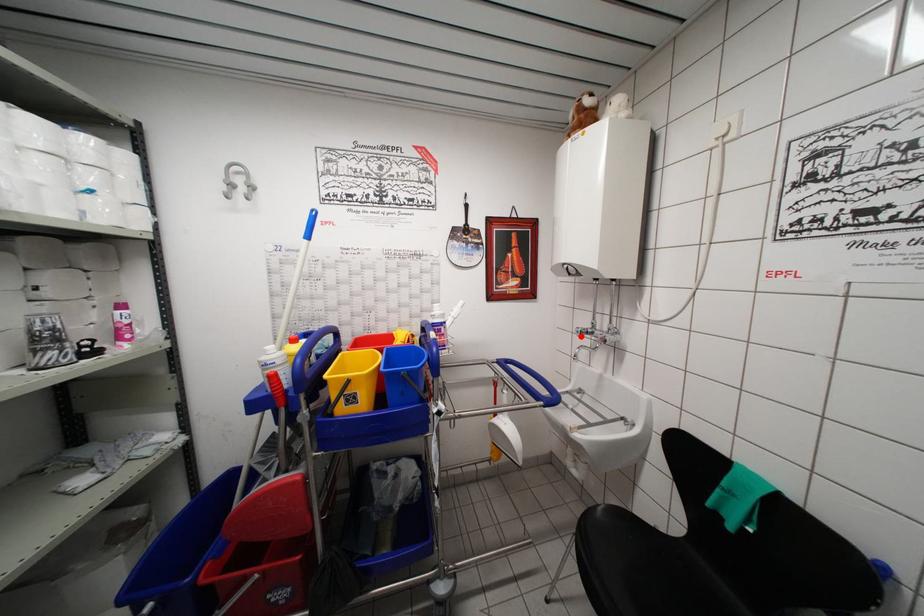
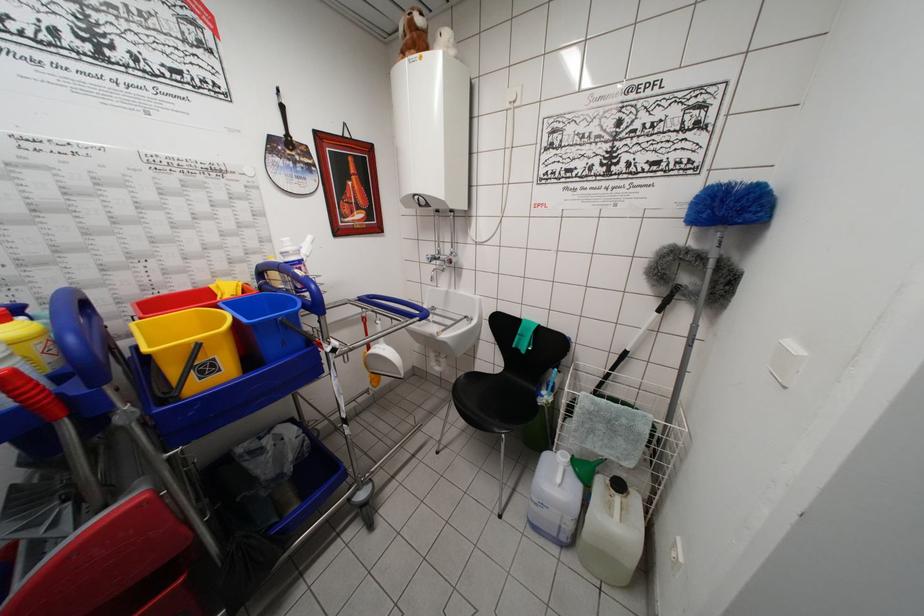
Find the pixel in the second image that matches the highlighted location in the first image.

(432, 262)